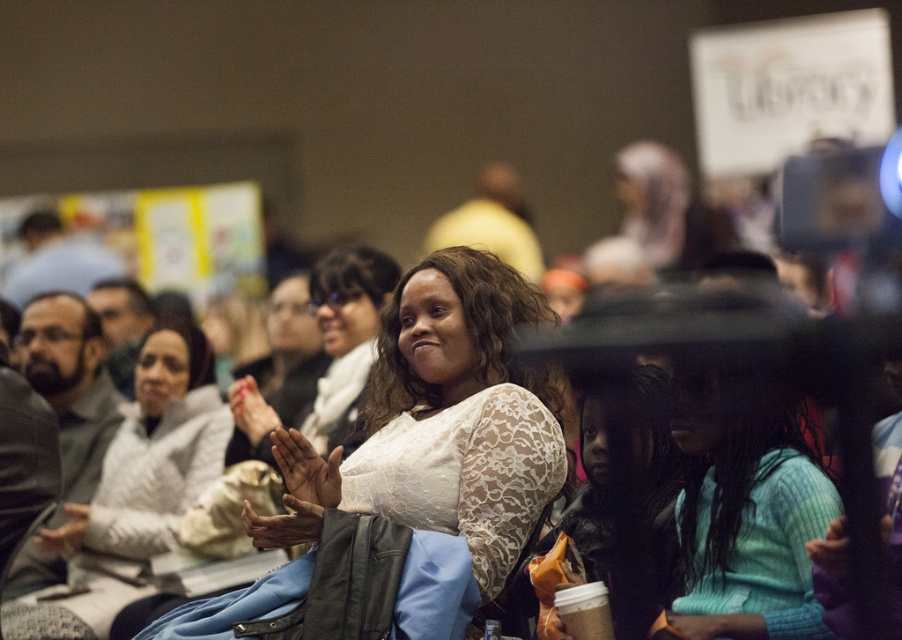
Question: Does white lace blouse at center appear on the left side of teal knitted sweater at center?

Choices:
 (A) no
 (B) yes

Answer: (B)

Question: Which of the following is the closest to the observer?

Choices:
 (A) white lace blouse at center
 (B) white lace shirt at center

Answer: (A)

Question: Where is white lace blouse at center located in relation to teal knitted sweater at center in the image?

Choices:
 (A) right
 (B) left

Answer: (B)

Question: Estimate the real-world distances between objects in this image. Which object is closer to the teal knitted sweater at center?

Choices:
 (A) white lace shirt at center
 (B) white lace blouse at center

Answer: (B)

Question: Estimate the real-world distances between objects in this image. Which object is closer to the white lace blouse at center?

Choices:
 (A) teal knitted sweater at center
 (B) white lace shirt at center

Answer: (A)

Question: Is teal knitted sweater at center smaller than white lace shirt at center?

Choices:
 (A) yes
 (B) no

Answer: (A)